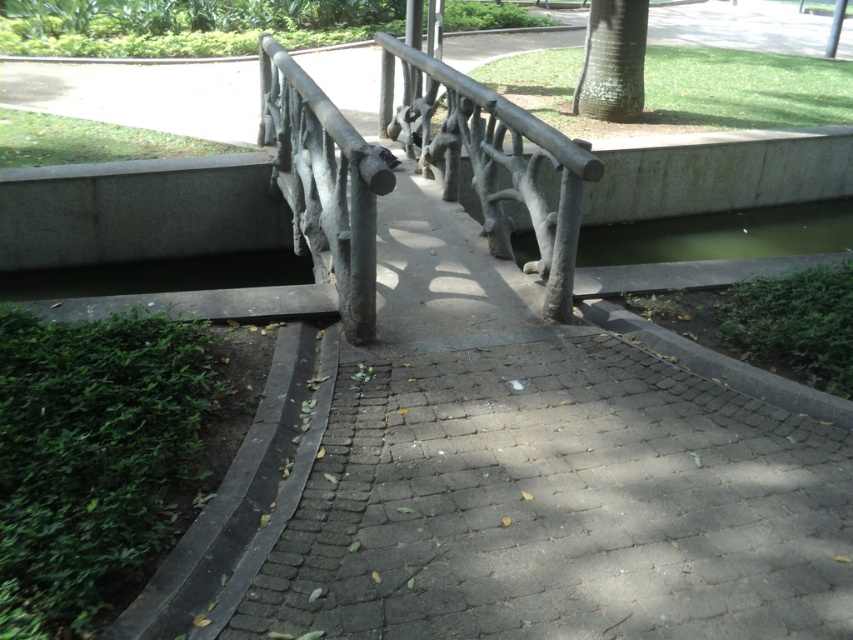
You are a painter standing on the walkway and want to paint both the rustic wood rail at center and the white textured bark at upper right. Given that your painting supplies are limited to a 15 feet reach, can you comfortably paint both objects without moving your position?

The rustic wood rail at center and white textured bark at upper right are 13.66 feet apart from each other. Since your maximum reach is 15 feet, you can comfortably paint both objects without moving your position as the distance between them is within your reach.

You are a painter setting up an easel to paint the rustic wood rail at center and the white textured bark at upper right. Which object should you focus on first if you want to paint the larger one first?

The rustic wood rail at center is larger in size than the white textured bark at upper right, so you should focus on painting the rustic wood rail at center first.